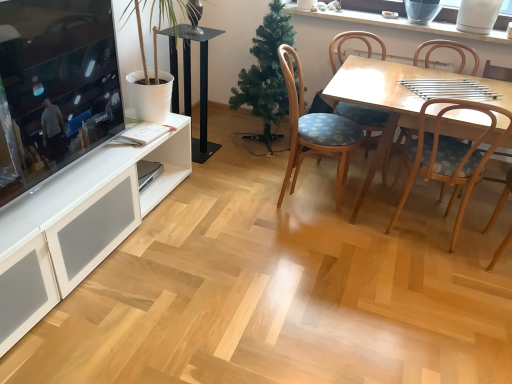
Locate an element on the screen. Image resolution: width=512 pixels, height=384 pixels. free region on the left part of green matte christmas tree at center is located at coordinates (219, 142).